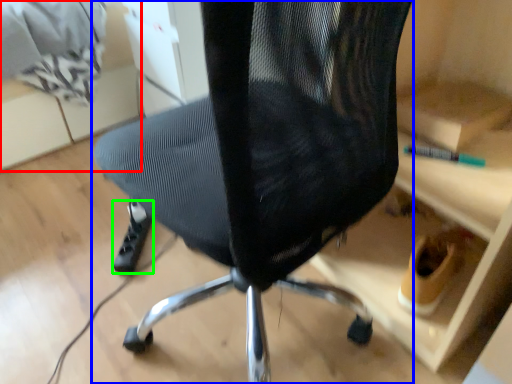
Question: Estimate the real-world distances between objects in this image. Which object is farther from shelf (highlighted by a red box), chair (highlighted by a blue box) or foot (highlighted by a green box)?

Choices:
 (A) chair
 (B) foot

Answer: (A)